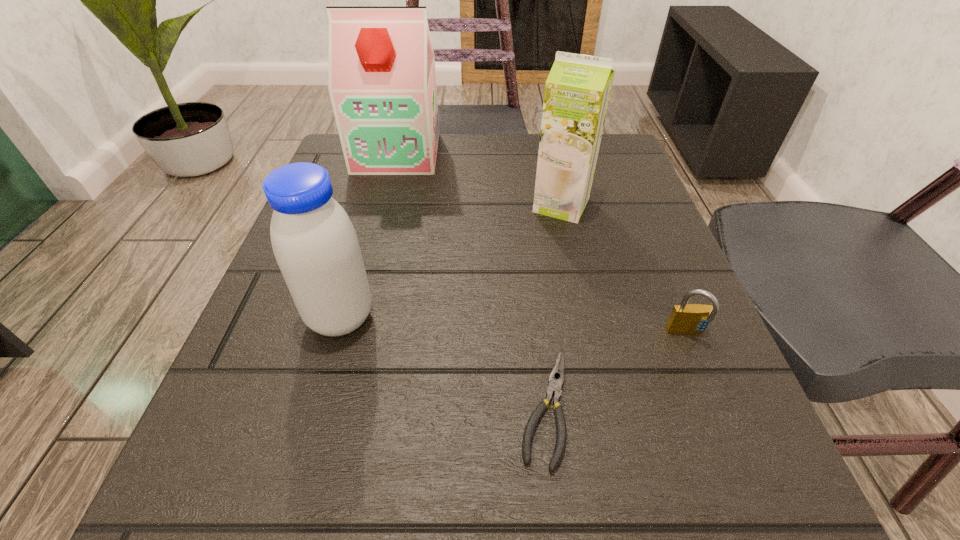
Image resolution: width=960 pixels, height=540 pixels. Find the location of `free space located 0.190m on the back of the nearest soya milk`. free space located 0.190m on the back of the nearest soya milk is located at coordinates (370, 218).

What are the coordinates of `blank area located on the side with the combination dials of the rightmost object` in the screenshot? It's located at (754, 497).

The height and width of the screenshot is (540, 960). Find the location of `free spot located on the left of the pliers`. free spot located on the left of the pliers is located at coordinates pyautogui.click(x=381, y=407).

This screenshot has width=960, height=540. Find the location of `object positioned at the near edge`. object positioned at the near edge is located at coordinates 554,387.

The image size is (960, 540). I want to click on soya milk positioned at the right edge, so click(x=577, y=90).

Where is `padlock at the right edge`? The image size is (960, 540). padlock at the right edge is located at coordinates (685, 318).

You are a GUI agent. You are given a task and a screenshot of the screen. Output one action in this format:
    pyautogui.click(x=<x>, y=<y>)
    Task: Click on the object located at the far left corner
    
    Given the screenshot: What is the action you would take?
    pyautogui.click(x=382, y=83)

At what (x,y) coordinates should I click in order to perform the action: click on object positioned at the far right corner. Please return your answer as a coordinate pair (x, y). Image resolution: width=960 pixels, height=540 pixels. Looking at the image, I should click on (577, 90).

The width and height of the screenshot is (960, 540). In order to click on vacant region at the far edge in this screenshot , I will do `click(476, 157)`.

In the image, there is a desktop. At what (x,y) coordinates should I click in order to perform the action: click on vacant space at the left edge. Please return your answer as a coordinate pair (x, y). Looking at the image, I should click on (282, 373).